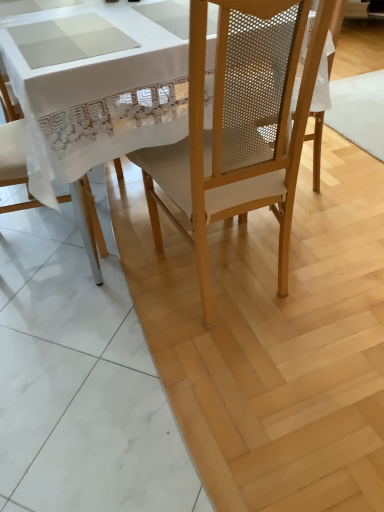
Question: From a real-world perspective, is white fabric chair at left, acting as the 2th chair starting from the right, physically above matte wood chair at center, the 1th chair when ordered from right to left?

Choices:
 (A) no
 (B) yes

Answer: (A)

Question: Is white fabric chair at left, acting as the 2th chair starting from the right, oriented away from matte wood chair at center, which is counted as the second chair, starting from the left?

Choices:
 (A) no
 (B) yes

Answer: (A)

Question: Considering the relative sizes of white fabric chair at left, which ranks as the first chair in left-to-right order, and matte wood chair at center, which is counted as the second chair, starting from the left, in the image provided, is white fabric chair at left, which ranks as the first chair in left-to-right order, wider than matte wood chair at center, which is counted as the second chair, starting from the left,?

Choices:
 (A) no
 (B) yes

Answer: (A)

Question: Is white fabric chair at left, acting as the 2th chair starting from the right, smaller than matte wood chair at center, the 1th chair when ordered from right to left?

Choices:
 (A) yes
 (B) no

Answer: (A)

Question: Can you confirm if white fabric chair at left, acting as the 2th chair starting from the right, is positioned to the left of matte wood chair at center, which is counted as the second chair, starting from the left?

Choices:
 (A) no
 (B) yes

Answer: (B)

Question: Based on their positions, is white fabric chair at left, acting as the 2th chair starting from the right, located to the left or right of matte wood chair at center, the 1th chair when ordered from right to left?

Choices:
 (A) right
 (B) left

Answer: (B)

Question: Is white fabric chair at left, which ranks as the first chair in left-to-right order, situated inside matte wood chair at center, the 1th chair when ordered from right to left, or outside?

Choices:
 (A) outside
 (B) inside

Answer: (A)

Question: From the image's perspective, is white fabric chair at left, which ranks as the first chair in left-to-right order, located above or below matte wood chair at center, the 1th chair when ordered from right to left?

Choices:
 (A) below
 (B) above

Answer: (B)

Question: Relative to matte wood chair at center, which is counted as the second chair, starting from the left, is white fabric chair at left, which ranks as the first chair in left-to-right order, in front or behind?

Choices:
 (A) front
 (B) behind

Answer: (B)

Question: From a real-world perspective, is matte wood chair at center above or below white fabric chair at left, acting as the 2th chair starting from the right?

Choices:
 (A) below
 (B) above

Answer: (A)

Question: Is point (251, 211) closer or farther from the camera than point (11, 145)?

Choices:
 (A) closer
 (B) farther

Answer: (B)

Question: In terms of size, does matte wood chair at center appear bigger or smaller than white fabric chair at left, acting as the 2th chair starting from the right?

Choices:
 (A) big
 (B) small

Answer: (A)

Question: Is matte wood chair at center inside the boundaries of white fabric chair at left, which ranks as the first chair in left-to-right order, or outside?

Choices:
 (A) outside
 (B) inside

Answer: (A)

Question: From their relative heights in the image, would you say matte wood chair at center, which is counted as the second chair, starting from the left, is taller or shorter than matte wood chair at center?

Choices:
 (A) tall
 (B) short

Answer: (A)

Question: From a real-world perspective, is matte wood chair at center, which is counted as the second chair, starting from the left, physically located above or below matte wood chair at center?

Choices:
 (A) above
 (B) below

Answer: (A)